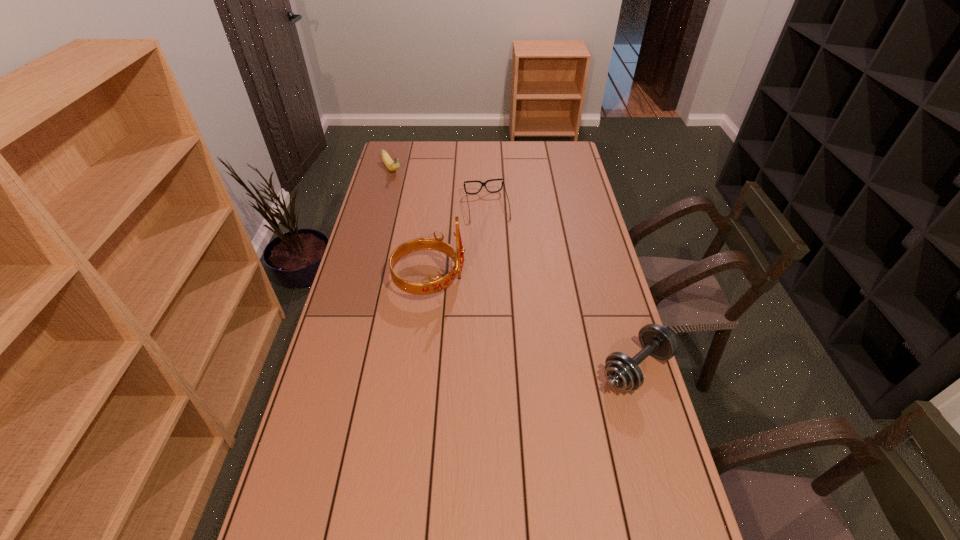
The image size is (960, 540). Find the location of `vacant point located 0.160m at the stem of the farthest object`. vacant point located 0.160m at the stem of the farthest object is located at coordinates (410, 197).

Identify the location of vacant region located 0.270m at the stem of the farthest object. (420, 210).

Where is `vacant space located at the stem of the farthest object`? vacant space located at the stem of the farthest object is located at coordinates (432, 224).

Find the location of a particular element. free spot located 0.070m with the lenses facing outward on the spectacles is located at coordinates (492, 235).

At what (x,y) coordinates should I click in order to perform the action: click on vacant space located 0.110m with the lenses facing outward on the spectacles. Please return your answer as a coordinate pair (x, y). Image resolution: width=960 pixels, height=540 pixels. Looking at the image, I should click on (494, 242).

Identify the location of free spot located with the lenses facing outward on the spectacles. This screenshot has height=540, width=960. (496, 252).

This screenshot has width=960, height=540. I want to click on object positioned at the far edge, so click(x=392, y=165).

This screenshot has width=960, height=540. In order to click on tiara situated at the left edge in this screenshot , I will do `click(437, 284)`.

Find the location of a particular element. The width and height of the screenshot is (960, 540). banana that is at the left edge is located at coordinates (392, 165).

This screenshot has height=540, width=960. I want to click on object situated at the right edge, so click(x=622, y=372).